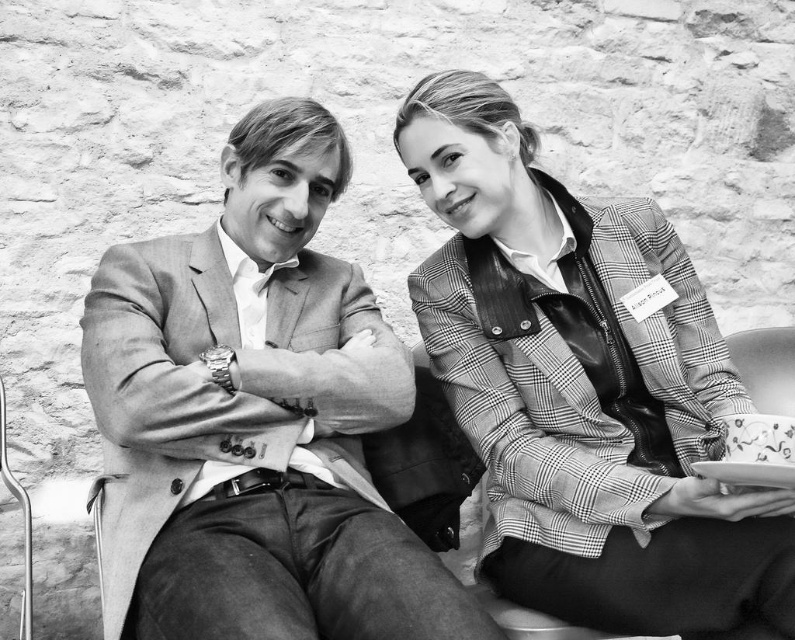
Between light brown leather jacket at center and checkered fabric blazer at center, which one is positioned higher?

checkered fabric blazer at center

This screenshot has width=795, height=640. What do you see at coordinates (256, 419) in the screenshot?
I see `light brown leather jacket at center` at bounding box center [256, 419].

I want to click on light brown leather jacket at center, so click(x=256, y=419).